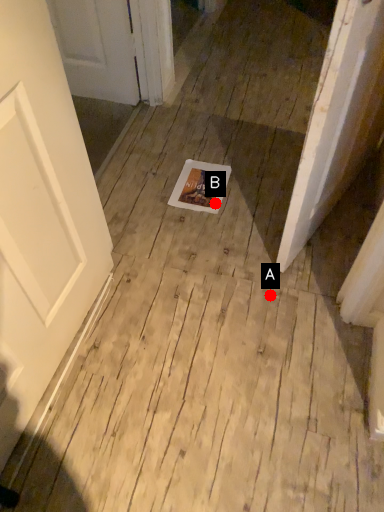
Question: Two points are circled on the image, labeled by A and B beside each circle. Which of the following is the farthest from the observer?

Choices:
 (A) A is further
 (B) B is further

Answer: (B)